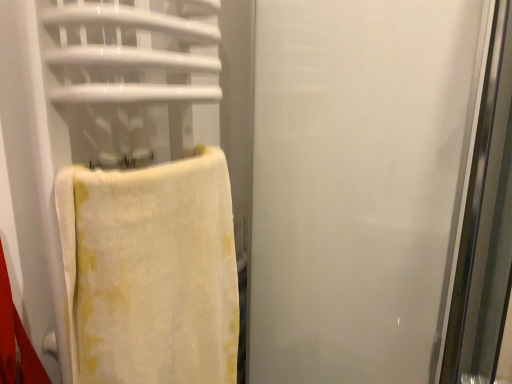
Question: Is yellow textured towel at left aimed at transparent frosted glass screen door at right?

Choices:
 (A) no
 (B) yes

Answer: (A)

Question: Considering the relative positions of yellow textured towel at left and transparent frosted glass screen door at right in the image provided, is yellow textured towel at left to the right of transparent frosted glass screen door at right from the viewer's perspective?

Choices:
 (A) no
 (B) yes

Answer: (A)

Question: Is transparent frosted glass screen door at right inside yellow textured towel at left?

Choices:
 (A) yes
 (B) no

Answer: (B)

Question: Is yellow textured towel at left taller than transparent frosted glass screen door at right?

Choices:
 (A) no
 (B) yes

Answer: (A)

Question: Is yellow textured towel at left positioned in front of transparent frosted glass screen door at right?

Choices:
 (A) no
 (B) yes

Answer: (B)

Question: Is yellow textured towel at left not within transparent frosted glass screen door at right?

Choices:
 (A) no
 (B) yes

Answer: (B)

Question: From the image's perspective, does transparent frosted glass screen door at right appear lower than yellow textured towel at left?

Choices:
 (A) yes
 (B) no

Answer: (B)

Question: Is transparent frosted glass screen door at right oriented towards yellow textured towel at left?

Choices:
 (A) yes
 (B) no

Answer: (A)

Question: Is yellow textured towel at left at the back of transparent frosted glass screen door at right?

Choices:
 (A) yes
 (B) no

Answer: (B)

Question: Is transparent frosted glass screen door at right at the right side of yellow textured towel at left?

Choices:
 (A) no
 (B) yes

Answer: (B)

Question: Considering the relative sizes of transparent frosted glass screen door at right and yellow textured towel at left in the image provided, is transparent frosted glass screen door at right wider than yellow textured towel at left?

Choices:
 (A) no
 (B) yes

Answer: (B)

Question: Is transparent frosted glass screen door at right to the left of yellow textured towel at left from the viewer's perspective?

Choices:
 (A) no
 (B) yes

Answer: (A)

Question: In the image, is yellow textured towel at left positioned in front of or behind transparent frosted glass screen door at right?

Choices:
 (A) behind
 (B) front

Answer: (B)